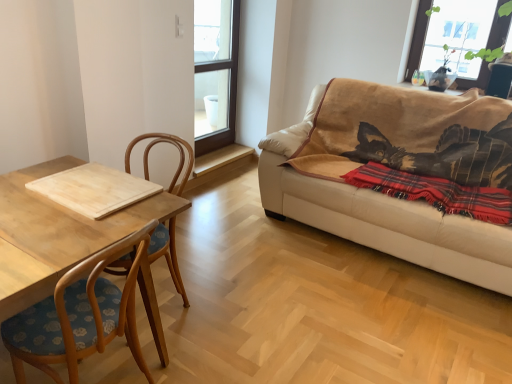
Find the location of a particular element. This screenshot has height=384, width=512. empty space that is in between light wood cutting board at left and beige leather couch at right is located at coordinates (x=282, y=291).